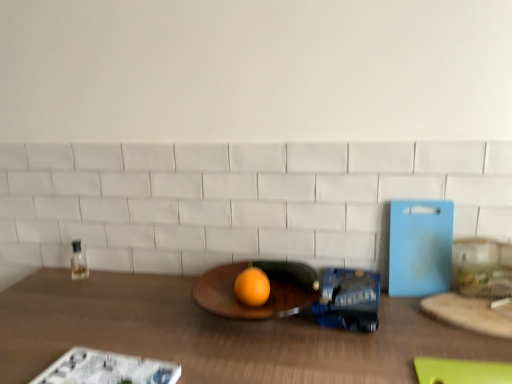
You are a GUI agent. You are given a task and a screenshot of the screen. Output one action in this format:
    pyautogui.click(x=<x>, y=<y>)
    Task: Click on the free location to the left of wooden cutting board at right
    
    Given the screenshot: What is the action you would take?
    pyautogui.click(x=406, y=330)